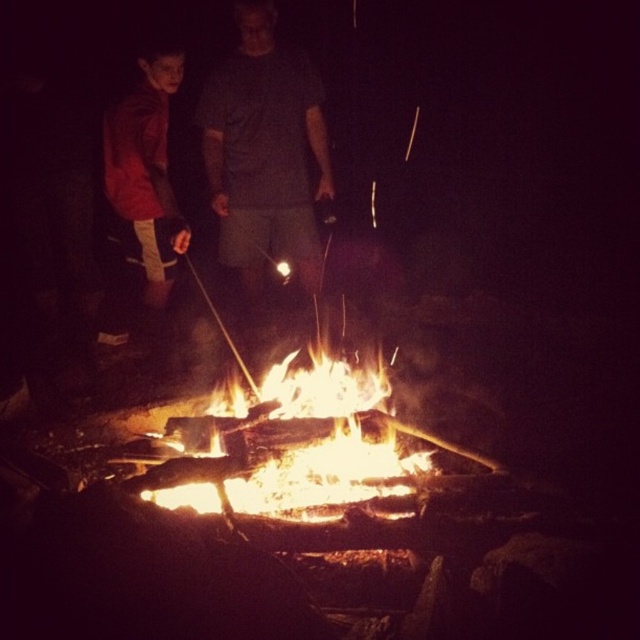
Can you confirm if gray cotton shirt at center is taller than matte red jacket at left?

Yes, gray cotton shirt at center is taller than matte red jacket at left.

Does gray cotton shirt at center come in front of matte red jacket at left?

No, it is behind matte red jacket at left.

Image resolution: width=640 pixels, height=640 pixels. I want to click on gray cotton shirt at center, so click(x=264, y=152).

Between flaming wood fire at center and matte red jacket at left, which one has more height?

Standing taller between the two is matte red jacket at left.

Between point (140, 493) and point (148, 321), which one is positioned in front?

Point (140, 493) is in front.

Locate an element on the screen. flaming wood fire at center is located at coordinates (324, 440).

How much distance is there between gray cotton shirt at center and flaming wood fire at center?

gray cotton shirt at center is 1.33 meters away from flaming wood fire at center.

Is point (208, 157) farther from camera compared to point (419, 458)?

That is True.

Locate an element on the screen. This screenshot has height=640, width=640. gray cotton shirt at center is located at coordinates (264, 152).